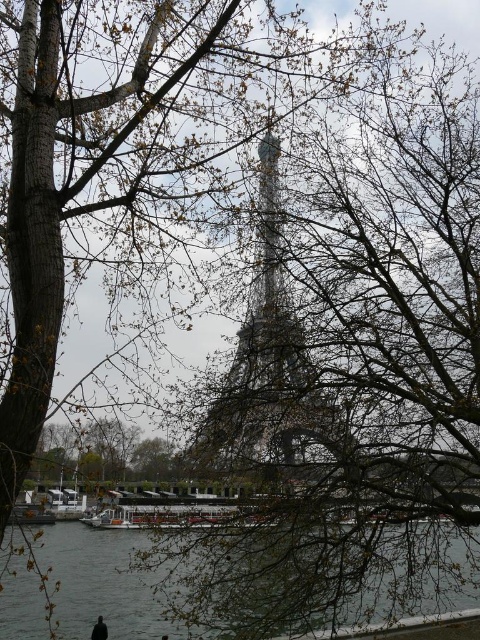
Does metallic silver eiffel tower at center appear on the right side of gray water at lower center?

Yes, metallic silver eiffel tower at center is to the right of gray water at lower center.

Between point (216, 472) and point (119, 570), which one is positioned in front?

Point (216, 472)

In order to click on metallic silver eiffel tower at center in this screenshot , I will do `click(269, 380)`.